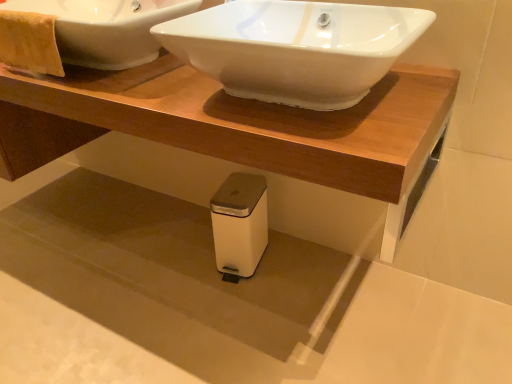
Question: Are white plastic trash can at lower center and yellow textured towel at upper left beside each other?

Choices:
 (A) no
 (B) yes

Answer: (A)

Question: Could yellow textured towel at upper left be considered to be inside white plastic trash can at lower center?

Choices:
 (A) no
 (B) yes

Answer: (A)

Question: Considering the relative sizes of white plastic trash can at lower center and yellow textured towel at upper left in the image provided, is white plastic trash can at lower center bigger than yellow textured towel at upper left?

Choices:
 (A) yes
 (B) no

Answer: (A)

Question: Is white plastic trash can at lower center to the right of yellow textured towel at upper left from the viewer's perspective?

Choices:
 (A) yes
 (B) no

Answer: (A)

Question: Can we say white plastic trash can at lower center lies outside yellow textured towel at upper left?

Choices:
 (A) yes
 (B) no

Answer: (A)

Question: From a real-world perspective, is white plastic trash can at lower center below yellow textured towel at upper left?

Choices:
 (A) yes
 (B) no

Answer: (A)

Question: Considering the relative positions of white glossy sink at upper center, marked as the 1th sink in a right-to-left arrangement, and yellow textured towel at upper left in the image provided, is white glossy sink at upper center, marked as the 1th sink in a right-to-left arrangement, in front of yellow textured towel at upper left?

Choices:
 (A) yes
 (B) no

Answer: (A)

Question: Considering the relative positions of white glossy sink at upper center, placed as the second sink when sorted from left to right, and yellow textured towel at upper left in the image provided, is white glossy sink at upper center, placed as the second sink when sorted from left to right, to the right of yellow textured towel at upper left from the viewer's perspective?

Choices:
 (A) no
 (B) yes

Answer: (B)

Question: Is white glossy sink at upper center, marked as the 1th sink in a right-to-left arrangement, facing towards yellow textured towel at upper left?

Choices:
 (A) yes
 (B) no

Answer: (B)

Question: Does white glossy sink at upper center, marked as the 1th sink in a right-to-left arrangement, have a greater height compared to yellow textured towel at upper left?

Choices:
 (A) yes
 (B) no

Answer: (B)

Question: Considering the relative sizes of white glossy sink at upper center, marked as the 1th sink in a right-to-left arrangement, and yellow textured towel at upper left in the image provided, is white glossy sink at upper center, marked as the 1th sink in a right-to-left arrangement, thinner than yellow textured towel at upper left?

Choices:
 (A) no
 (B) yes

Answer: (A)

Question: From a real-world perspective, is white glossy sink at upper center, marked as the 1th sink in a right-to-left arrangement, physically above yellow textured towel at upper left?

Choices:
 (A) no
 (B) yes

Answer: (A)

Question: Would you say yellow textured towel at upper left is a long distance from white matte trash can at lower center?

Choices:
 (A) yes
 (B) no

Answer: (B)